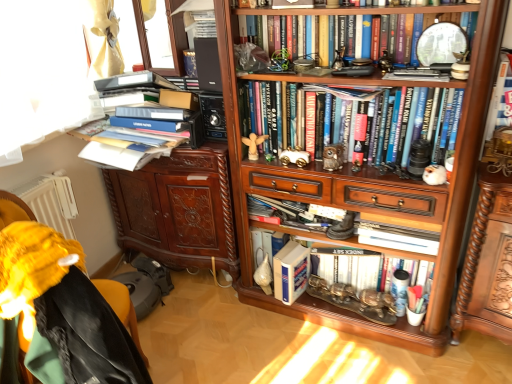
Image resolution: width=512 pixels, height=384 pixels. I want to click on free location in front of brown carved cabinet at left, so click(204, 327).